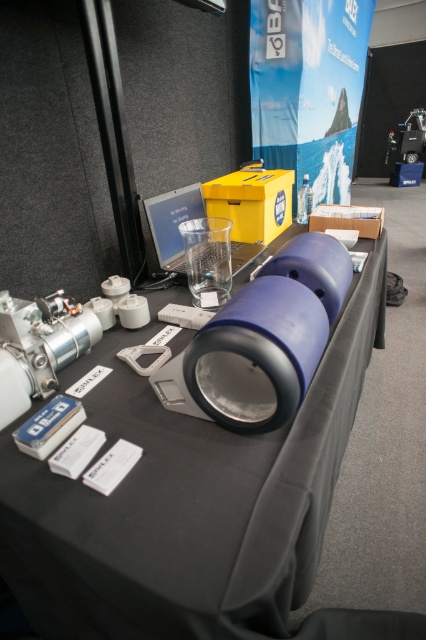
Is point (103, 412) behind point (302, 205)?

No.

Is point (45, 595) closer to camera compared to point (298, 220)?

Yes, it is.

Where is `blue plastic cylinder at center`? The height and width of the screenshot is (640, 426). blue plastic cylinder at center is located at coordinates (187, 502).